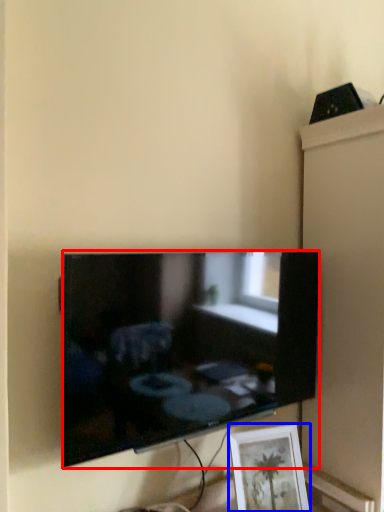
Question: Which of the following is the closest to the observer, television (highlighted by a red box) or picture frame (highlighted by a blue box)?

Choices:
 (A) television
 (B) picture frame

Answer: (A)